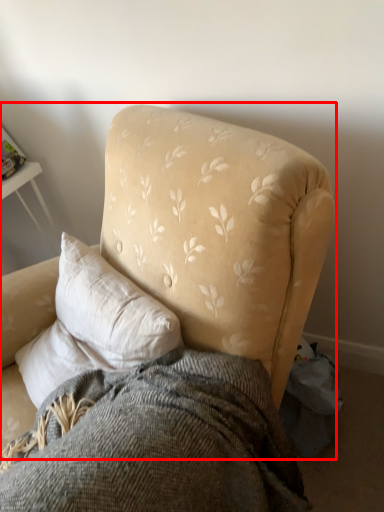
Question: From the image's perspective, where is chair (annotated by the red box) located in relation to bedding in the image?

Choices:
 (A) above
 (B) below

Answer: (A)